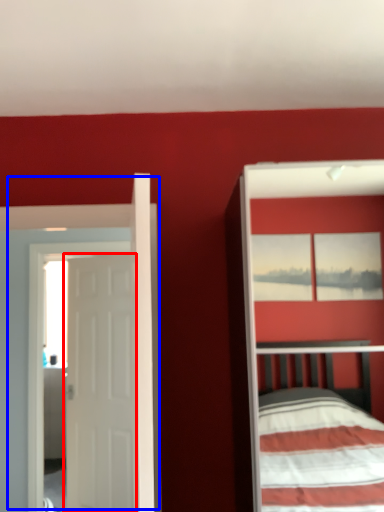
Question: Which object appears farthest to the camera in this image, door (highlighted by a red box) or door (highlighted by a blue box)?

Choices:
 (A) door
 (B) door

Answer: (A)